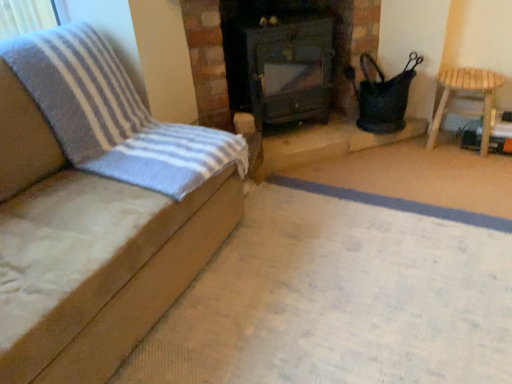
Question: Can light brown wooden stool at right, which is the second furniture in left-to-right order, be found inside dark green wood stove at center?

Choices:
 (A) yes
 (B) no

Answer: (B)

Question: Does dark green wood stove at center appear on the left side of light brown wooden stool at right, which ranks as the 1th furniture in back-to-front order?

Choices:
 (A) yes
 (B) no

Answer: (A)

Question: From the image's perspective, would you say dark green wood stove at center is shown under light brown wooden stool at right, which is the second furniture in left-to-right order?

Choices:
 (A) yes
 (B) no

Answer: (B)

Question: Does dark green wood stove at center come behind light brown wooden stool at right, which ranks as the first furniture in right-to-left order?

Choices:
 (A) no
 (B) yes

Answer: (A)

Question: Can you confirm if dark green wood stove at center is positioned to the right of light brown wooden stool at right, arranged as the 2th furniture when viewed from the front?

Choices:
 (A) no
 (B) yes

Answer: (A)

Question: Is suede-like beige sofa at left, which ranks as the 1th furniture in front-to-back order, inside the boundaries of dark green wood stove at center, or outside?

Choices:
 (A) outside
 (B) inside

Answer: (A)

Question: Looking at their shapes, would you say suede-like beige sofa at left, which appears as the first furniture when viewed from the left, is wider or thinner than dark green wood stove at center?

Choices:
 (A) thin
 (B) wide

Answer: (B)

Question: From a real-world perspective, is suede-like beige sofa at left, the second furniture when ordered from right to left, physically located above or below dark green wood stove at center?

Choices:
 (A) below
 (B) above

Answer: (B)

Question: Is point (197, 251) closer or farther from the camera than point (285, 59)?

Choices:
 (A) farther
 (B) closer

Answer: (B)

Question: Which is correct: light brown wooden stool at right, which ranks as the 1th furniture in back-to-front order, is inside dark green wood stove at center, or outside of it?

Choices:
 (A) outside
 (B) inside

Answer: (A)

Question: In the image, is light brown wooden stool at right, which is the second furniture in left-to-right order, positioned in front of or behind dark green wood stove at center?

Choices:
 (A) behind
 (B) front

Answer: (A)

Question: From a real-world perspective, is light brown wooden stool at right, which ranks as the first furniture in right-to-left order, positioned above or below dark green wood stove at center?

Choices:
 (A) below
 (B) above

Answer: (A)

Question: Considering the positions of light brown wooden stool at right, which ranks as the 1th furniture in back-to-front order, and dark green wood stove at center in the image, is light brown wooden stool at right, which ranks as the 1th furniture in back-to-front order, taller or shorter than dark green wood stove at center?

Choices:
 (A) short
 (B) tall

Answer: (A)

Question: Choose the correct answer: Is suede-like beige sofa at left, the second furniture when ordered from right to left, inside light brown wooden stool at right, which ranks as the 1th furniture in back-to-front order, or outside it?

Choices:
 (A) outside
 (B) inside

Answer: (A)

Question: Does point click(x=103, y=288) appear closer or farther from the camera than point click(x=487, y=127)?

Choices:
 (A) farther
 (B) closer

Answer: (B)